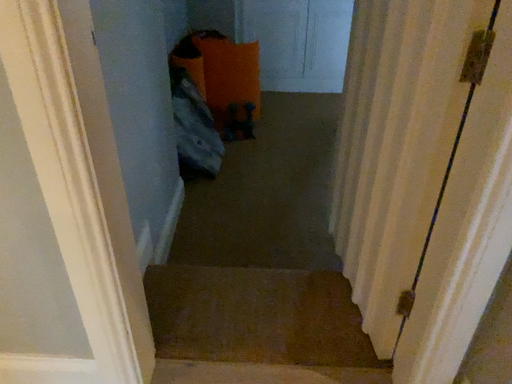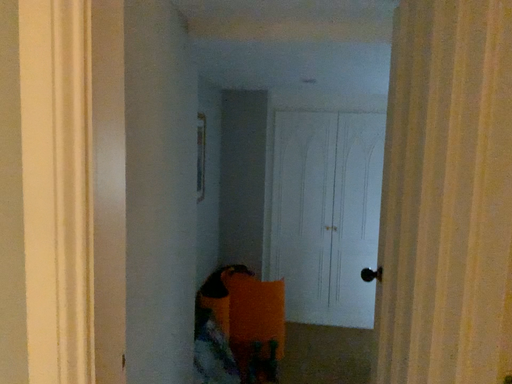
Question: Which way did the camera rotate in the video?

Choices:
 (A) rotated downward
 (B) rotated upward

Answer: (B)